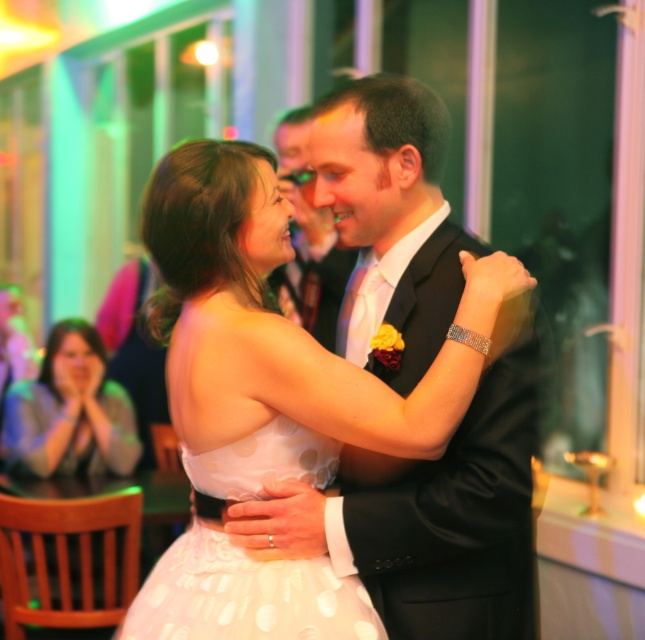
Who is positioned more to the right, white satin dress at center or white dotted dress at lower left?

white satin dress at center

Can you confirm if white satin dress at center is shorter than white dotted dress at lower left?

No.

In order to click on white satin dress at center in this screenshot , I will do `click(281, 337)`.

At what (x,y) coordinates should I click in order to perform the action: click on white satin dress at center. Please return your answer as a coordinate pair (x, y). This screenshot has width=645, height=640. Looking at the image, I should click on point(281,337).

Which is below, white dotted dress at lower left or black satin suit at center?

white dotted dress at lower left

Which is behind, point (126, 406) or point (339, 257)?

Positioned behind is point (126, 406).

Image resolution: width=645 pixels, height=640 pixels. I want to click on white dotted dress at lower left, so point(70,412).

Can you confirm if white dotted fabric dress at center is smaller than white dotted dress at lower left?

Yes.

What do you see at coordinates (244, 595) in the screenshot?
I see `white dotted fabric dress at center` at bounding box center [244, 595].

Locate an element on the screen. This screenshot has width=645, height=640. white dotted fabric dress at center is located at coordinates (244, 595).